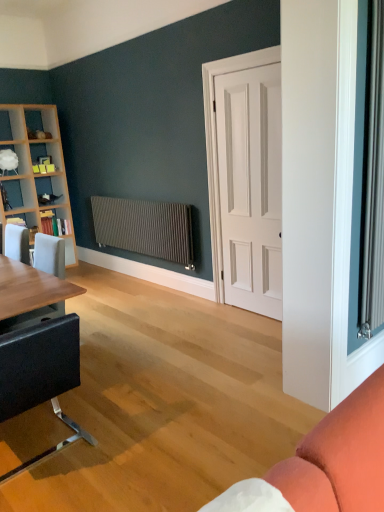
The width and height of the screenshot is (384, 512). Find the location of `free space to the right of black leather chair at lower left`. free space to the right of black leather chair at lower left is located at coordinates (128, 450).